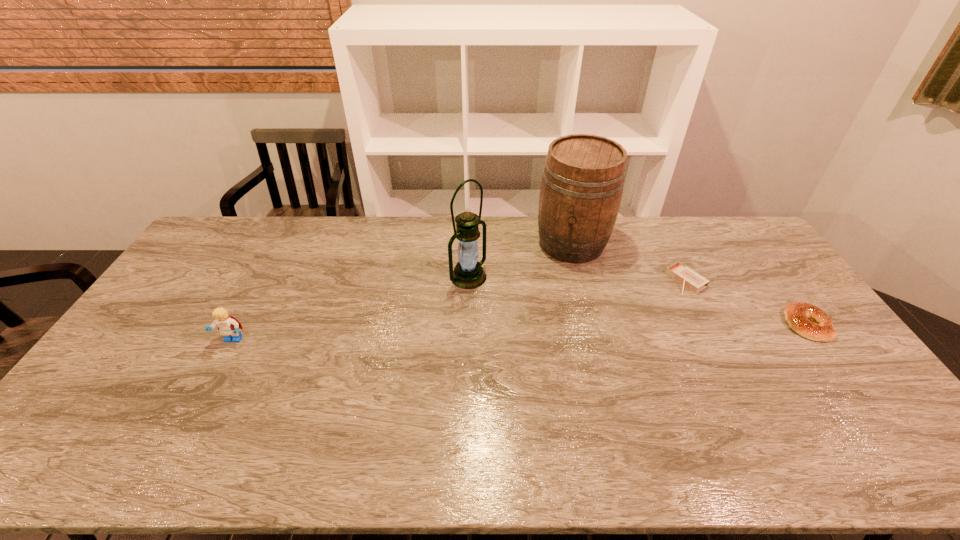
Find the location of `Lego`. Lego is located at coordinates (228, 325).

Locate an element on the screen. Image resolution: width=960 pixels, height=540 pixels. the leftmost object is located at coordinates (228, 325).

Image resolution: width=960 pixels, height=540 pixels. Identify the location of bagel. (809, 321).

In order to click on lantern in this screenshot , I will do `click(468, 273)`.

The height and width of the screenshot is (540, 960). Find the location of `cider`. cider is located at coordinates (583, 178).

Where is `matchbox`? This screenshot has width=960, height=540. matchbox is located at coordinates (684, 275).

You are a GUI agent. You are given a task and a screenshot of the screen. Output one action in this format:
    pyautogui.click(x=<x>, y=<y>)
    Task: Click on the vacant space located 0.130m on the front-facing side of the Lego
    This screenshot has height=540, width=960.
    Given the screenshot: What is the action you would take?
    pyautogui.click(x=207, y=388)

This screenshot has height=540, width=960. In order to click on free space located 0.140m on the back of the bagel in this screenshot , I will do `click(772, 278)`.

Where is `vacant space located on the side where the lantern emits light`? The width and height of the screenshot is (960, 540). vacant space located on the side where the lantern emits light is located at coordinates (579, 352).

The height and width of the screenshot is (540, 960). Identify the location of free region located on the side where the lantern emits light. (564, 342).